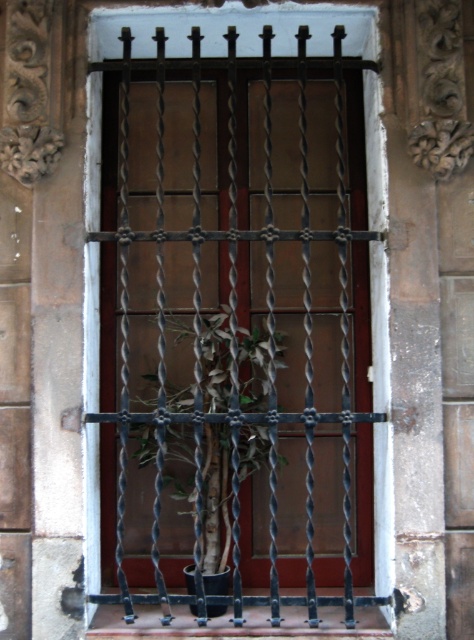
You are standing in front of the building facade and want to place a new decoration exactly where the green leafy plant at center is currently located. What are the coordinates of the spot where you should place your decoration?

The coordinates for the green leafy plant at center are at point [204,486], so you should place your decoration there.

You are a gardener who wants to place a new potted plant on the smooth concrete window sill at center. The new plant is as wide as the existing green leafy plant at center. Will the new plant fit on the window sill?

The green leafy plant at center is narrower than the smooth concrete window sill at center, so the new plant, being the same width as the existing one, will fit on the window sill.